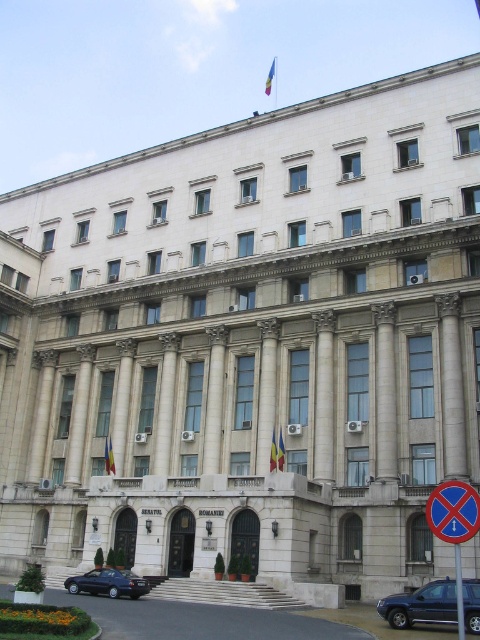
Question: Is blue plastic sign at lower right positioned behind blue fabric flag at center?

Choices:
 (A) no
 (B) yes

Answer: (A)

Question: Considering the real-world distances, which object is closest to the polychrome fabric flag at upper center?

Choices:
 (A) shiny dark blue sedan at lower left
 (B) metallic reflective no parking at center
 (C) metallic blue suv at lower right
 (D) yellow fabric flag at center

Answer: (D)

Question: Among these points, which one is farthest from the camera?

Choices:
 (A) pyautogui.click(x=84, y=580)
 (B) pyautogui.click(x=464, y=586)
 (C) pyautogui.click(x=456, y=502)

Answer: (A)

Question: Can you confirm if metallic reflective no parking at center is bigger than yellow fabric flag at center?

Choices:
 (A) yes
 (B) no

Answer: (A)

Question: Does blue plastic sign at lower right appear on the right side of metallic reflective no parking at center?

Choices:
 (A) no
 (B) yes

Answer: (B)

Question: Considering the real-world distances, which object is farthest from the yellow fabric flag at center?

Choices:
 (A) blue fabric flag at center
 (B) blue plastic sign at lower right
 (C) metallic blue suv at lower right

Answer: (B)